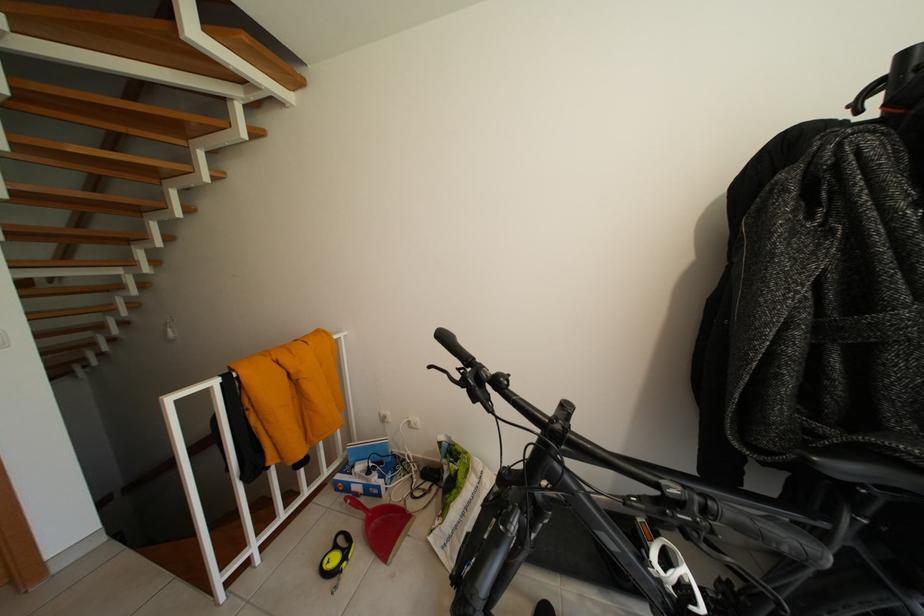
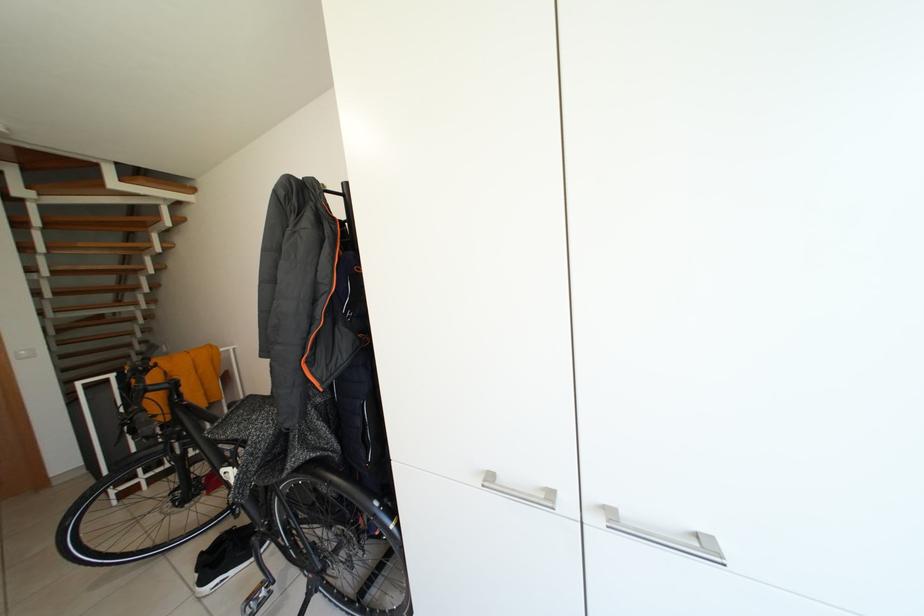
Question: What movement of the cameraman would produce the second image?

Choices:
 (A) Left
 (B) Right
 (C) Forward
 (D) Backward

Answer: (B)